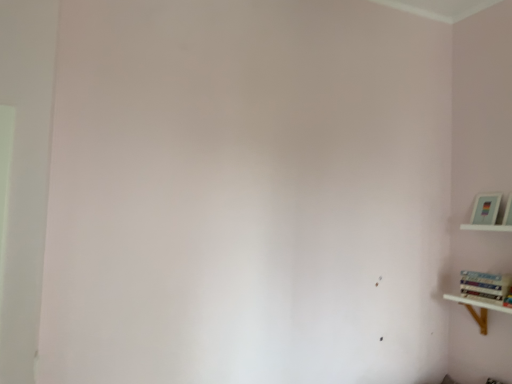
Question: Looking at their shapes, would you say white wooden shelf at lower right, the 1th shelf in the bottom-to-top sequence, is wider or thinner than hardcover book at right?

Choices:
 (A) wide
 (B) thin

Answer: (A)

Question: Considering their positions, is white wooden shelf at lower right, which is the 2th shelf from top to bottom, located in front of or behind hardcover book at right?

Choices:
 (A) front
 (B) behind

Answer: (A)

Question: Based on their relative distances, which object is farther from the white wooden shelf at upper right, the 2th shelf when ordered from bottom to top?

Choices:
 (A) hardcover book at right
 (B) white wooden shelf at lower right, the 1th shelf in the bottom-to-top sequence

Answer: (B)

Question: Considering the real-world distances, which object is farthest from the white wooden shelf at lower right, the 1th shelf in the bottom-to-top sequence?

Choices:
 (A) white wooden shelf at upper right, the first shelf from the top
 (B) hardcover book at right

Answer: (A)